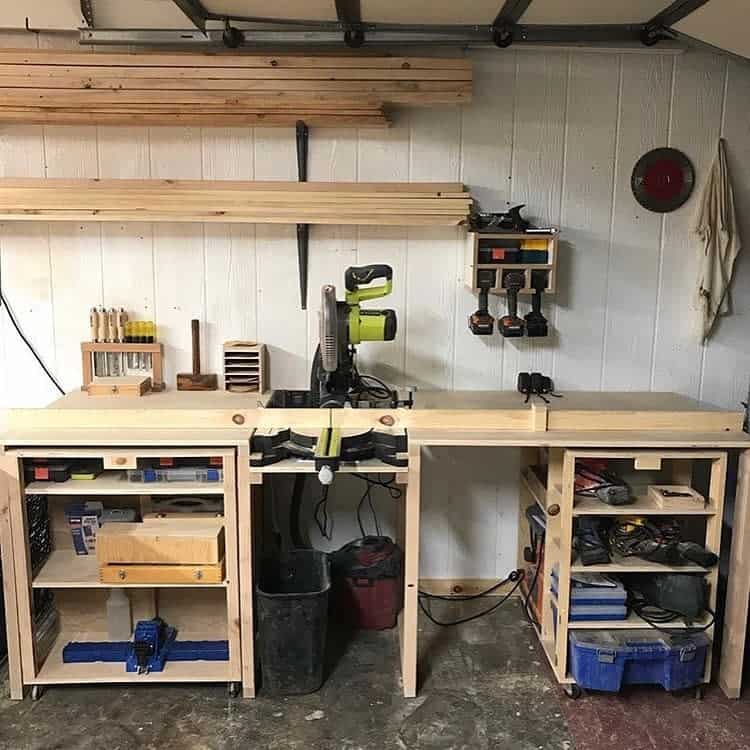
The image size is (750, 750). In order to click on floor in this screenshot , I will do `click(469, 715)`.